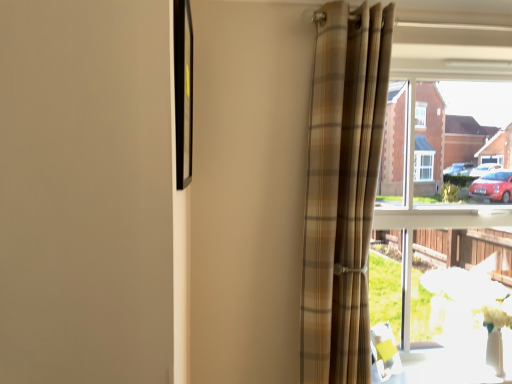
Question: Considering the relative sizes of clear glass window at right and plaid fabric curtain at right in the image provided, is clear glass window at right bigger than plaid fabric curtain at right?

Choices:
 (A) yes
 (B) no

Answer: (B)

Question: Is clear glass window at right smaller than plaid fabric curtain at right?

Choices:
 (A) yes
 (B) no

Answer: (A)

Question: Is clear glass window at right thinner than plaid fabric curtain at right?

Choices:
 (A) no
 (B) yes

Answer: (B)

Question: Is clear glass window at right in front of plaid fabric curtain at right?

Choices:
 (A) no
 (B) yes

Answer: (A)

Question: Is clear glass window at right at the right side of plaid fabric curtain at right?

Choices:
 (A) no
 (B) yes

Answer: (B)

Question: Does clear glass window at right turn towards plaid fabric curtain at right?

Choices:
 (A) no
 (B) yes

Answer: (A)

Question: Can you confirm if white glossy table at lower right is shorter than clear glass window at right?

Choices:
 (A) no
 (B) yes

Answer: (B)

Question: From the image's perspective, is white glossy table at lower right located above clear glass window at right?

Choices:
 (A) yes
 (B) no

Answer: (B)

Question: Is white glossy table at lower right to the right of clear glass window at right from the viewer's perspective?

Choices:
 (A) yes
 (B) no

Answer: (B)

Question: From a real-world perspective, is white glossy table at lower right physically below clear glass window at right?

Choices:
 (A) no
 (B) yes

Answer: (B)

Question: Is white glossy table at lower right positioned in front of clear glass window at right?

Choices:
 (A) yes
 (B) no

Answer: (A)

Question: Would you say white glossy table at lower right is outside clear glass window at right?

Choices:
 (A) yes
 (B) no

Answer: (A)

Question: Considering the relative sizes of clear glass window at right and black glossy picture frame at upper left in the image provided, is clear glass window at right wider than black glossy picture frame at upper left?

Choices:
 (A) no
 (B) yes

Answer: (B)